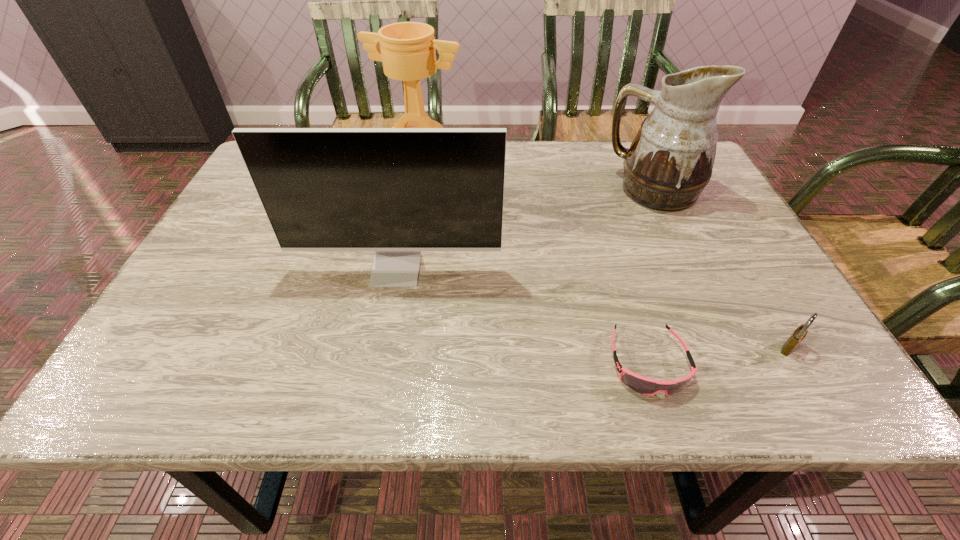
The image size is (960, 540). In order to click on free space at the near right corner of the desktop in this screenshot , I will do `click(791, 384)`.

The image size is (960, 540). In order to click on vacant area that lies between the monitor and the second shortest object in this screenshot , I will do pos(592,309).

Where is `vacant area that lies between the shortest object and the padlock`? This screenshot has width=960, height=540. vacant area that lies between the shortest object and the padlock is located at coordinates (718, 355).

I want to click on free spot between the pitcher and the award, so click(537, 177).

At what (x,y) coordinates should I click in order to perform the action: click on vacant space in between the shortest object and the pitcher. Please return your answer as a coordinate pair (x, y). Looking at the image, I should click on (651, 276).

I want to click on vacant space that is in between the goggles and the second shortest object, so click(x=718, y=355).

Locate an element on the screen. This screenshot has height=540, width=960. unoccupied area between the second shortest object and the pitcher is located at coordinates (721, 269).

Find the location of `vacant space that's between the padlock and the shortest object`. vacant space that's between the padlock and the shortest object is located at coordinates (718, 355).

In order to click on free space between the goggles and the pitcher in this screenshot , I will do `click(651, 276)`.

This screenshot has height=540, width=960. Find the location of `free space between the third farthest object and the fourth tallest object`. free space between the third farthest object and the fourth tallest object is located at coordinates point(592,309).